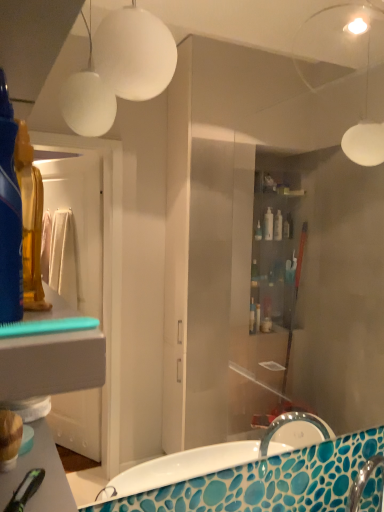
Locate an element on the screen. The width and height of the screenshot is (384, 512). translucent plastic mouthwash at left is located at coordinates (9, 216).

What is the approximate width of translucent plastic mouthwash at left?

translucent plastic mouthwash at left is 1.70 inches wide.

What do you see at coordinates (9, 216) in the screenshot? Image resolution: width=384 pixels, height=512 pixels. I see `translucent plastic mouthwash at left` at bounding box center [9, 216].

At what (x,y) coordinates should I click in order to perform the action: click on translucent plastic mouthwash at left. Please return your answer as a coordinate pair (x, y). The width and height of the screenshot is (384, 512). Looking at the image, I should click on (9, 216).